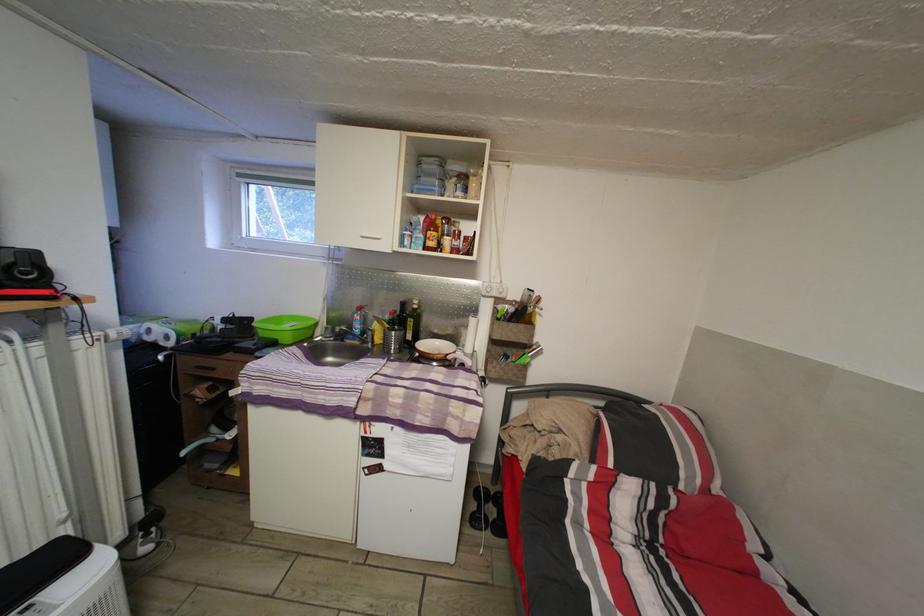
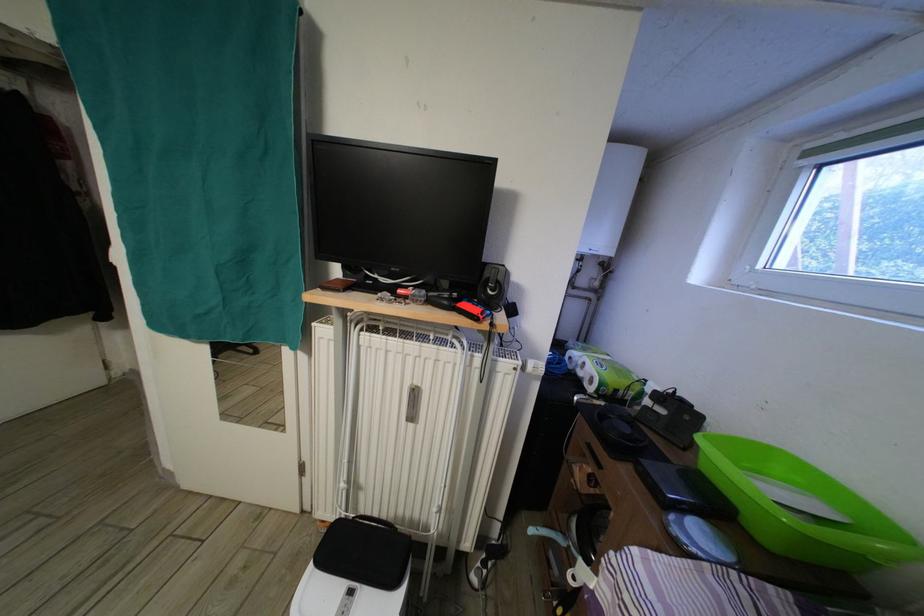
Question: The camera is either moving clockwise (left) or counter-clockwise (right) around the object. The first image is from the beginning of the video and the second image is from the end. Is the camera moving left or right when shooting the video?

Choices:
 (A) Left
 (B) Right

Answer: (B)